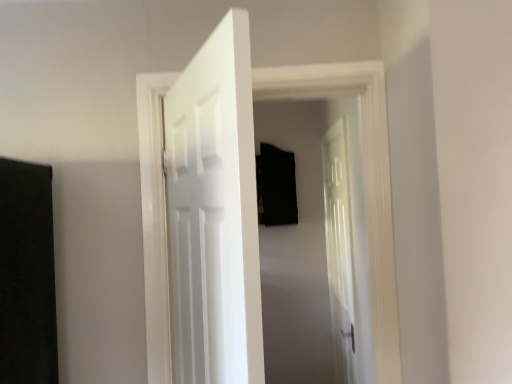
Question: Is white glossy door at center, arranged as the third door when viewed from the back, inside or outside of white glossy door at center, the third door from the left?

Choices:
 (A) inside
 (B) outside

Answer: (B)

Question: From the image's perspective, is white glossy door at center, arranged as the third door when viewed from the back, above or below white glossy door at center, which is the third door from front to back?

Choices:
 (A) below
 (B) above

Answer: (B)

Question: Which object is the closest to the white wooden door at center, arranged as the second door when viewed from the back?

Choices:
 (A) white glossy door at center, which is the third door from front to back
 (B) white glossy door at center, arranged as the 3th door when viewed from the right

Answer: (B)

Question: Estimate the real-world distances between objects in this image. Which object is closer to the white glossy door at center, arranged as the 3th door when viewed from the right?

Choices:
 (A) white wooden door at center, the 2th door viewed from the right
 (B) white glossy door at center, placed as the first door when sorted from right to left

Answer: (A)